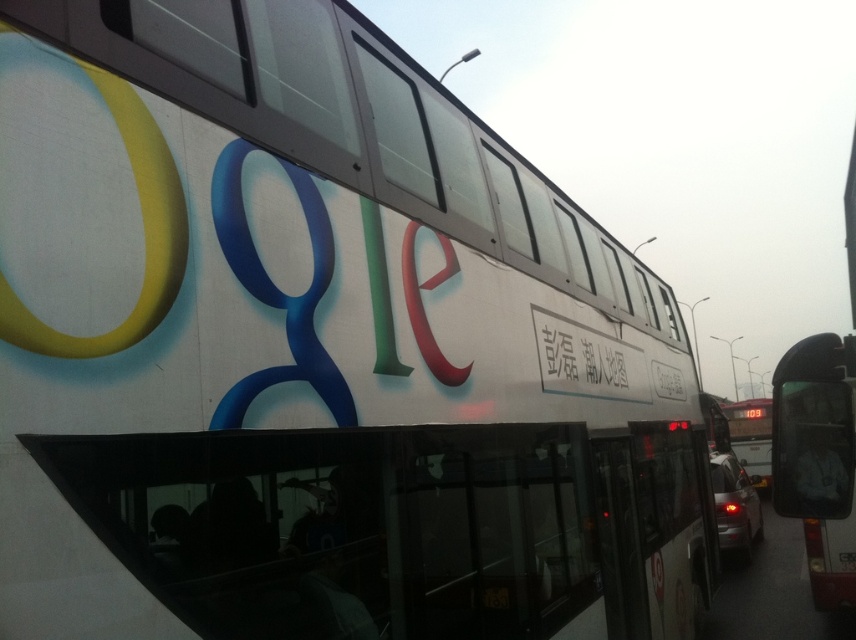
Question: Can you confirm if white glossy bus at right is thinner than black matte sign at center?

Choices:
 (A) yes
 (B) no

Answer: (B)

Question: Where is white glossy bus at right located in relation to white matte bus at center in the image?

Choices:
 (A) above
 (B) below

Answer: (A)

Question: Does white glossy bus at right come behind white matte bus at center?

Choices:
 (A) no
 (B) yes

Answer: (A)

Question: Which of these objects is positioned closest to the white glossy bus at right?

Choices:
 (A) black matte sign at center
 (B) white matte bus at center

Answer: (A)

Question: Which point appears farthest from the camera in this image?

Choices:
 (A) (x=835, y=465)
 (B) (x=586, y=339)
 (C) (x=759, y=420)

Answer: (C)

Question: Which is farther from the white matte bus at center?

Choices:
 (A) white glossy bus at right
 (B) black matte sign at center

Answer: (B)